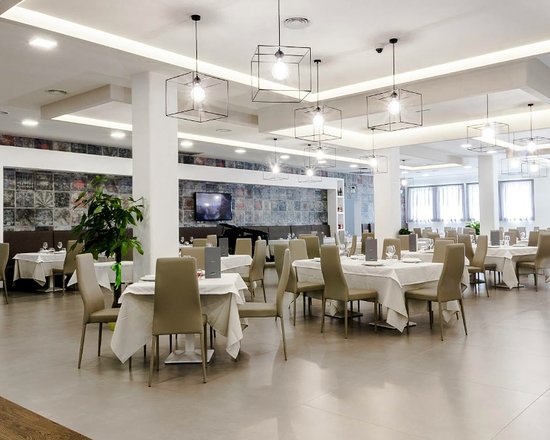
You are a GUI agent. You are given a task and a screenshot of the screen. Output one action in this format:
    pyautogui.click(x=<x>, y=<y>)
    Task: Click on the recessed ceiling lights
    The width and height of the screenshot is (550, 440).
    Given the screenshot: What is the action you would take?
    pyautogui.click(x=115, y=134), pyautogui.click(x=30, y=121), pyautogui.click(x=38, y=41), pyautogui.click(x=189, y=144), pyautogui.click(x=238, y=150), pyautogui.click(x=282, y=155), pyautogui.click(x=321, y=162), pyautogui.click(x=460, y=146), pyautogui.click(x=490, y=153), pyautogui.click(x=425, y=176)